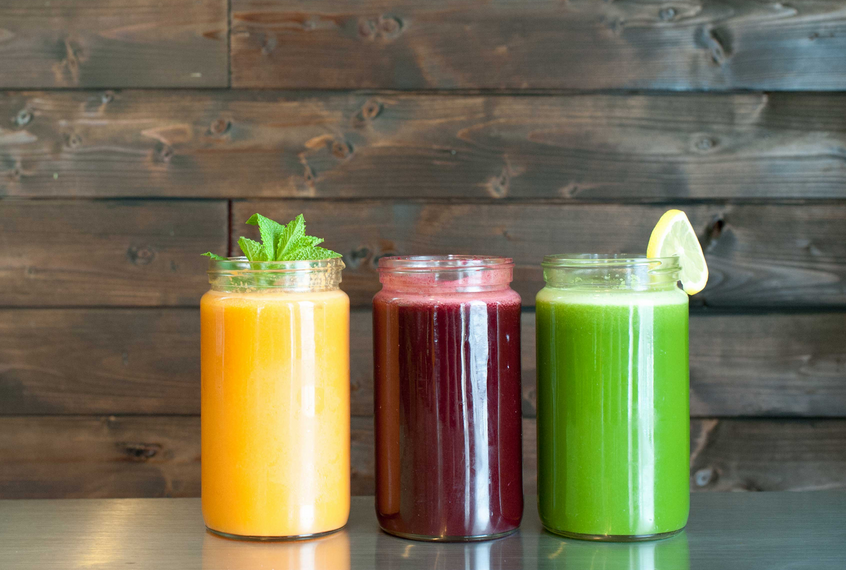
Find the location of a particular element. Image resolution: width=846 pixels, height=570 pixels. counter is located at coordinates (759, 525).